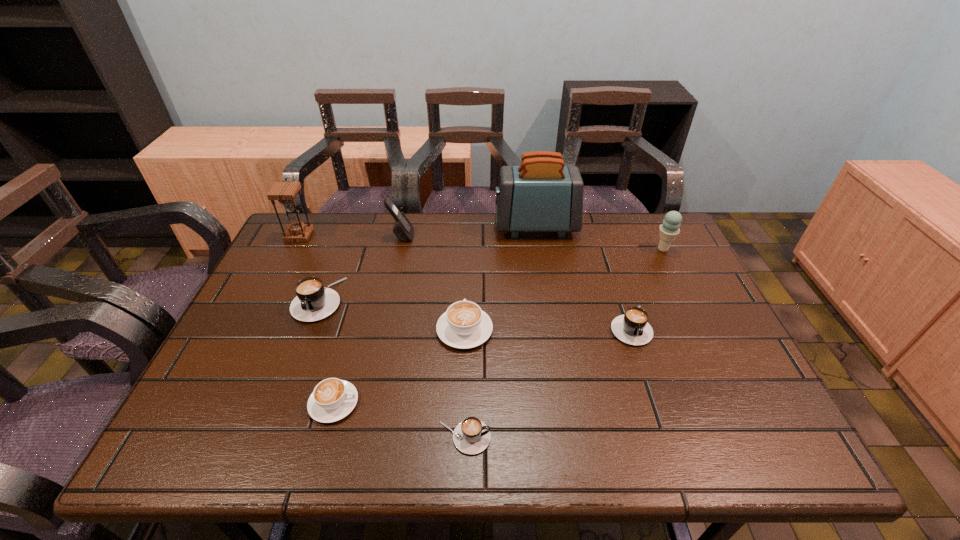
Identify the location of the third object from right to left. (541, 195).

Locate an element on the screen. toaster is located at coordinates (541, 195).

The height and width of the screenshot is (540, 960). Identify the location of the leftmost object. (285, 192).

Where is `hourglass`? hourglass is located at coordinates (285, 192).

The width and height of the screenshot is (960, 540). Find the location of `cellular telephone`. cellular telephone is located at coordinates (403, 229).

This screenshot has width=960, height=540. I want to click on the rightmost object, so click(670, 228).

Where is `blue ice cream`? This screenshot has height=540, width=960. blue ice cream is located at coordinates (670, 228).

Locate an element on the screen. The height and width of the screenshot is (540, 960). the leftmost cappuccino is located at coordinates (313, 302).

In order to click on the tallest cappuccino in this screenshot , I will do `click(313, 302)`.

Identify the location of the bigger white cappuccino. This screenshot has height=540, width=960. (464, 325).